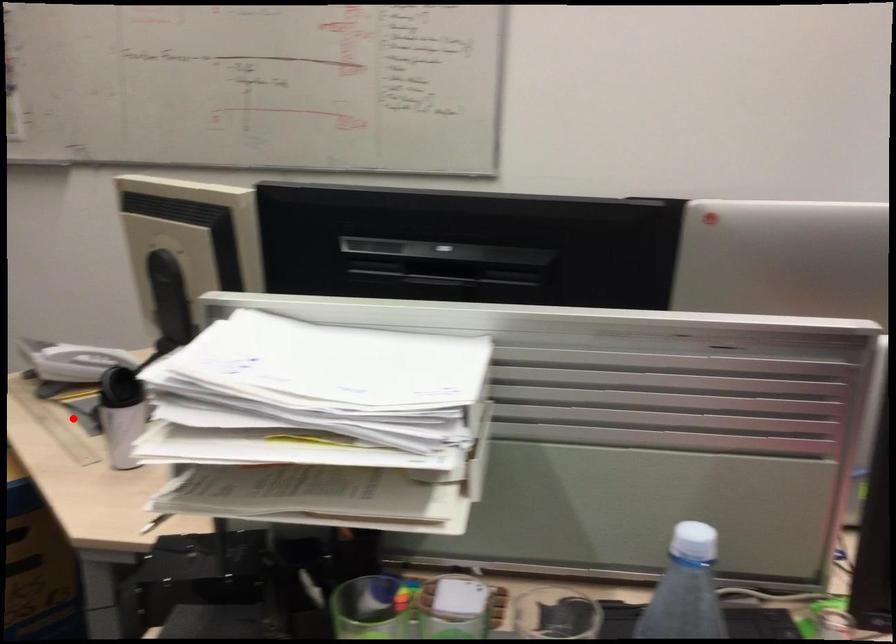
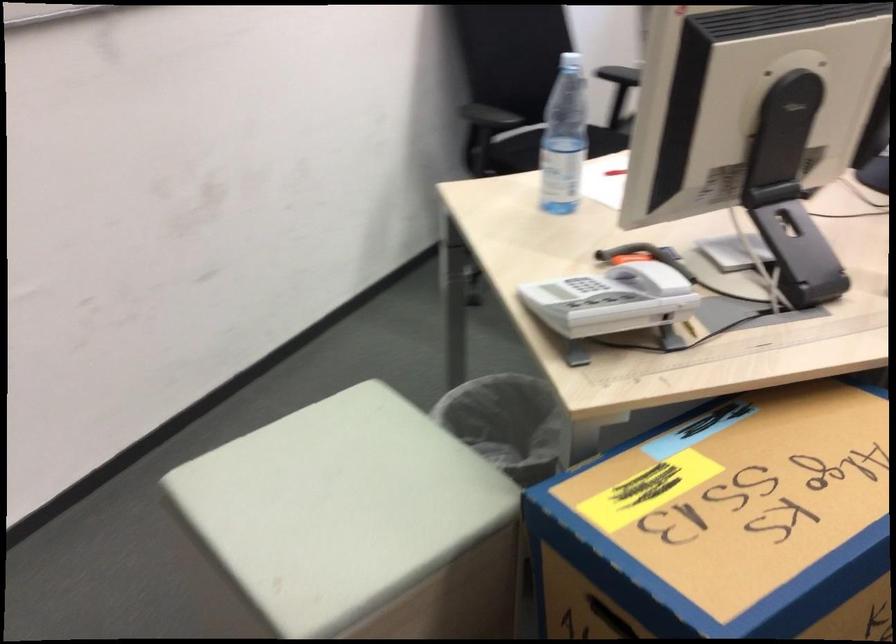
Question: I am providing you with two images of the same scene from different viewpoints. In image1, a red point is highlighted. Considering the same 3D point in image2, which of the following is correct?

Choices:
 (A) It is closer
 (B) It is farther

Answer: (A)